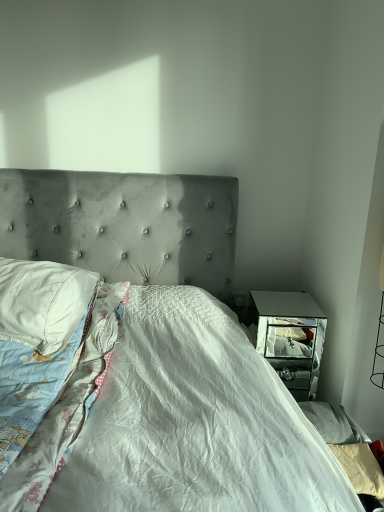
Question: From a real-world perspective, is velvet gray bed at center physically located above or below white cotton pillow at left?

Choices:
 (A) above
 (B) below

Answer: (B)

Question: Is point (122, 238) positioned closer to the camera than point (38, 284)?

Choices:
 (A) closer
 (B) farther

Answer: (B)

Question: Considering the real-world distances, which object is closest to the white cotton blanket at left?

Choices:
 (A) velvet gray bed at center
 (B) white cotton pillow at left

Answer: (A)

Question: Which object is the farthest from the velvet gray bed at center?

Choices:
 (A) white cotton blanket at left
 (B) white cotton pillow at left

Answer: (B)